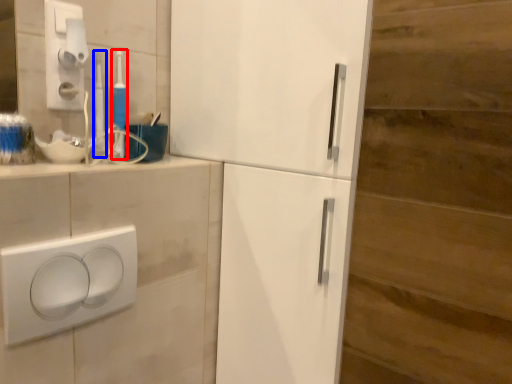
Question: Which of the following is the farthest to the observer, toothbrush (highlighted by a red box) or toothbrush (highlighted by a blue box)?

Choices:
 (A) toothbrush
 (B) toothbrush

Answer: (A)